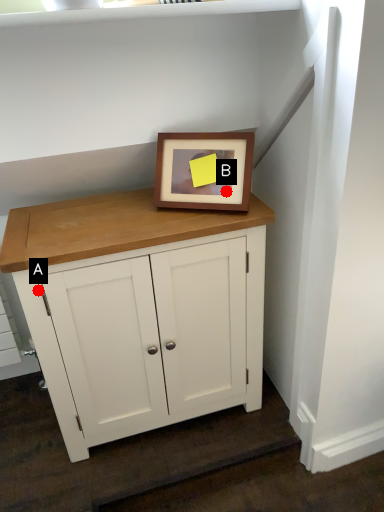
Question: Two points are circled on the image, labeled by A and B beside each circle. Which of the following is the closest to the observer?

Choices:
 (A) A is closer
 (B) B is closer

Answer: (A)